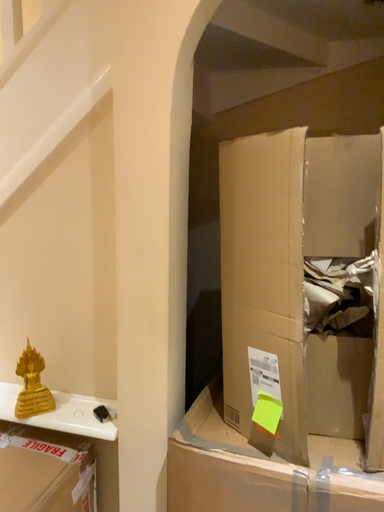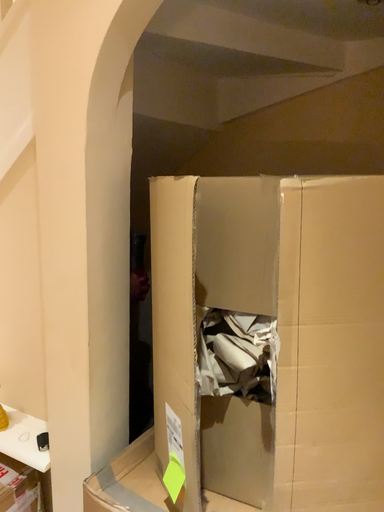
Question: Which way did the camera rotate in the video?

Choices:
 (A) rotated right
 (B) rotated left

Answer: (B)